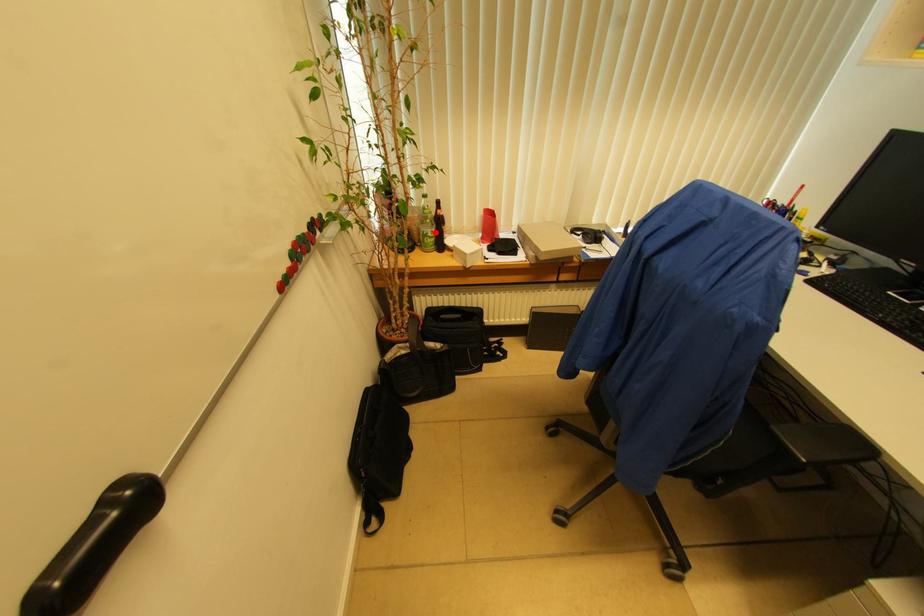
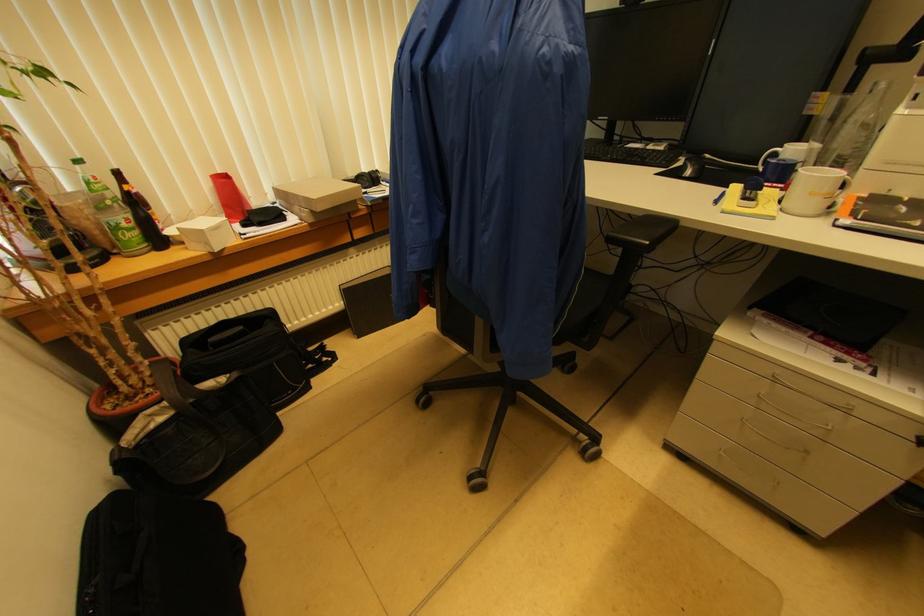
Where in the second image is the point corresponding to the highlighted location from the first image?

(131, 219)